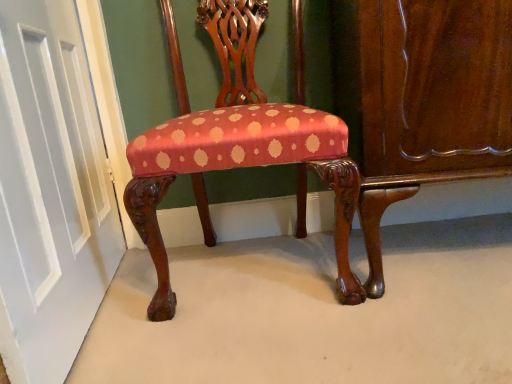
Find the location of `silky red fabric chair at center`. silky red fabric chair at center is located at coordinates (237, 145).

This screenshot has width=512, height=384. What do you see at coordinates (426, 99) in the screenshot?
I see `glossy wood dresser at lower right` at bounding box center [426, 99].

The height and width of the screenshot is (384, 512). In order to click on silky red fabric chair at center in this screenshot , I will do `click(237, 145)`.

Is silky red fabric chair at center oriented towards white painted wood door at left?

No, silky red fabric chair at center is not oriented towards white painted wood door at left.

Does silky red fabric chair at center appear on the right side of white painted wood door at left?

Correct, you'll find silky red fabric chair at center to the right of white painted wood door at left.

From the picture: Considering the relative sizes of silky red fabric chair at center and white painted wood door at left in the image provided, is silky red fabric chair at center shorter than white painted wood door at left?

Yes, silky red fabric chair at center is shorter than white painted wood door at left.

From the image's perspective, is silky red fabric chair at center located beneath white painted wood door at left?

No.

From the image's perspective, which is above, silky red fabric chair at center or glossy wood dresser at lower right?

glossy wood dresser at lower right.

Is glossy wood dresser at lower right inside silky red fabric chair at center?

No.

Locate an element on the screen. Image resolution: width=512 pixels, height=384 pixels. dresser on the right side of silky red fabric chair at center is located at coordinates (426, 99).

Are silky red fabric chair at center and glossy wood dresser at lower right beside each other?

silky red fabric chair at center and glossy wood dresser at lower right are not in contact.

Can you tell me how much glossy wood dresser at lower right and white painted wood door at left differ in facing direction?

The facing directions of glossy wood dresser at lower right and white painted wood door at left are 81.9 degrees apart.

From the picture: Is the position of glossy wood dresser at lower right less distant than that of white painted wood door at left?

No, glossy wood dresser at lower right is behind white painted wood door at left.

Does glossy wood dresser at lower right contain white painted wood door at left?

No, white painted wood door at left is not inside glossy wood dresser at lower right.

From the image's perspective, is glossy wood dresser at lower right above silky red fabric chair at center?

Yes, from the image's perspective, glossy wood dresser at lower right is above silky red fabric chair at center.

Can you confirm if glossy wood dresser at lower right is positioned to the left of silky red fabric chair at center?

In fact, glossy wood dresser at lower right is to the right of silky red fabric chair at center.

In the scene shown: Are glossy wood dresser at lower right and silky red fabric chair at center making contact?

No, glossy wood dresser at lower right is not next to silky red fabric chair at center.

Identify the location of chair that is on the left side of glossy wood dresser at lower right. (x=237, y=145).

In the scene shown: Considering the relative sizes of white painted wood door at left and silky red fabric chair at center in the image provided, is white painted wood door at left smaller than silky red fabric chair at center?

Yes, white painted wood door at left is smaller than silky red fabric chair at center.

Is white painted wood door at left at the left side of silky red fabric chair at center?

Yes, white painted wood door at left is to the left of silky red fabric chair at center.

Can silky red fabric chair at center be found inside white painted wood door at left?

No.

Is white painted wood door at left positioned with its back to silky red fabric chair at center?

Correct, white painted wood door at left is looking away from silky red fabric chair at center.

From a real-world perspective, is white painted wood door at left located beneath glossy wood dresser at lower right?

No, from a real-world perspective, white painted wood door at left is not beneath glossy wood dresser at lower right.

From the image's perspective, which is below, white painted wood door at left or glossy wood dresser at lower right?

white painted wood door at left.

Is white painted wood door at left turned away from glossy wood dresser at lower right?

Yes, white painted wood door at left is positioned with its back facing glossy wood dresser at lower right.

Which is behind, white painted wood door at left or glossy wood dresser at lower right?

glossy wood dresser at lower right is behind.

Locate an element on the screen. This screenshot has height=384, width=512. door in front of the silky red fabric chair at center is located at coordinates (50, 192).

The height and width of the screenshot is (384, 512). What are the coordinates of `dresser on the right of the silky red fabric chair at center` in the screenshot? It's located at (426, 99).

Based on their spatial positions, is white painted wood door at left or silky red fabric chair at center closer to glossy wood dresser at lower right?

silky red fabric chair at center lies closer to glossy wood dresser at lower right than the other object.

Looking at the image, which one is located closer to white painted wood door at left, glossy wood dresser at lower right or silky red fabric chair at center?

Based on the image, silky red fabric chair at center appears to be nearer to white painted wood door at left.

Which object lies nearer to the anchor point glossy wood dresser at lower right, silky red fabric chair at center or white painted wood door at left?

silky red fabric chair at center is positioned closer to the anchor glossy wood dresser at lower right.

Looking at the image, which one is located further to silky red fabric chair at center, glossy wood dresser at lower right or white painted wood door at left?

Based on the image, white painted wood door at left appears to be further to silky red fabric chair at center.

Which object lies further to the anchor point white painted wood door at left, silky red fabric chair at center or glossy wood dresser at lower right?

glossy wood dresser at lower right is further to white painted wood door at left.

Consider the image. When comparing their distances from silky red fabric chair at center, does white painted wood door at left or glossy wood dresser at lower right seem further?

The object further to silky red fabric chair at center is white painted wood door at left.

At what (x,y) coordinates should I click in order to perform the action: click on chair situated between white painted wood door at left and glossy wood dresser at lower right from left to right. Please return your answer as a coordinate pair (x, y). Looking at the image, I should click on (237, 145).